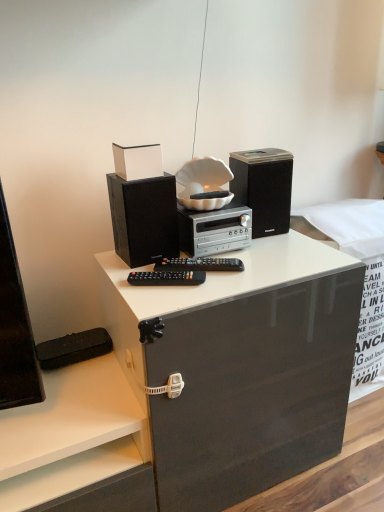
Question: Does point (246, 233) appear closer or farther from the camera than point (175, 271)?

Choices:
 (A) farther
 (B) closer

Answer: (A)

Question: Is silver metallic stereo at center wider or thinner than black plastic remote control at center?

Choices:
 (A) thin
 (B) wide

Answer: (B)

Question: Which object is positioned closest to the black matte speaker at upper right, the second speaker positioned from the left?

Choices:
 (A) white glossy box at upper center
 (B) black matte speaker at left, which ranks as the 2th speaker in right-to-left order
 (C) black plastic remote control at center
 (D) black plastic remote control at center
 (E) silver metallic stereo at center

Answer: (E)

Question: Which object is the closest to the black matte speaker at left, the first speaker in the left-to-right sequence?

Choices:
 (A) white glossy box at upper center
 (B) black plastic remote control at center
 (C) silver metallic stereo at center
 (D) black plastic remote control at center
 (E) black matte speaker at upper right, the second speaker positioned from the left

Answer: (C)